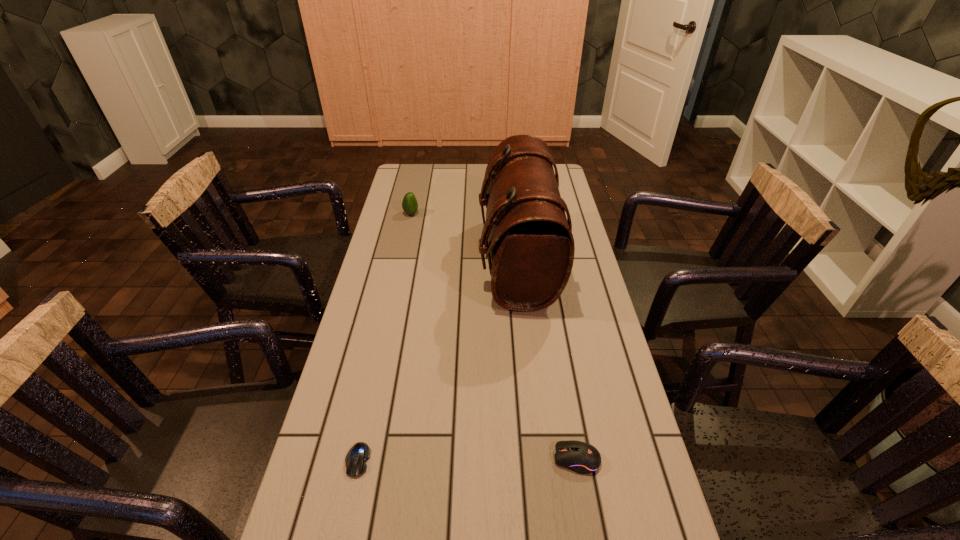
At what (x,y) coordinates should I click in order to perform the action: click on free space that satisfies the following two spatial constraints: 1. on the front-facing side of the third nearest object; 2. on the right side of the right computer mouse. Please return your answer as a coordinate pair (x, y). Looking at the image, I should click on (538, 459).

This screenshot has width=960, height=540. I want to click on free region that satisfies the following two spatial constraints: 1. on the front-facing side of the taller computer mouse; 2. on the left side of the tallest object, so click(538, 459).

This screenshot has width=960, height=540. I want to click on vacant space that satisfies the following two spatial constraints: 1. on the front-facing side of the tallest object; 2. on the back side of the taller computer mouse, so click(x=538, y=459).